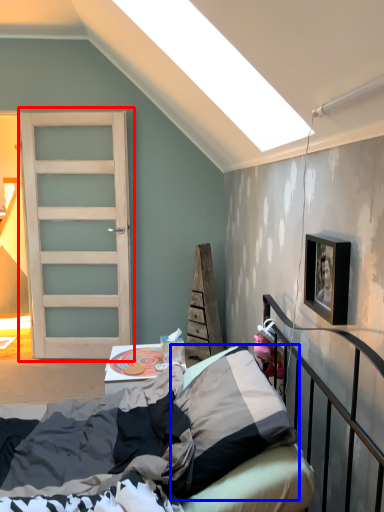
Question: Which object appears closest to the camera in this image, door (highlighted by a red box) or pillow (highlighted by a blue box)?

Choices:
 (A) door
 (B) pillow

Answer: (B)